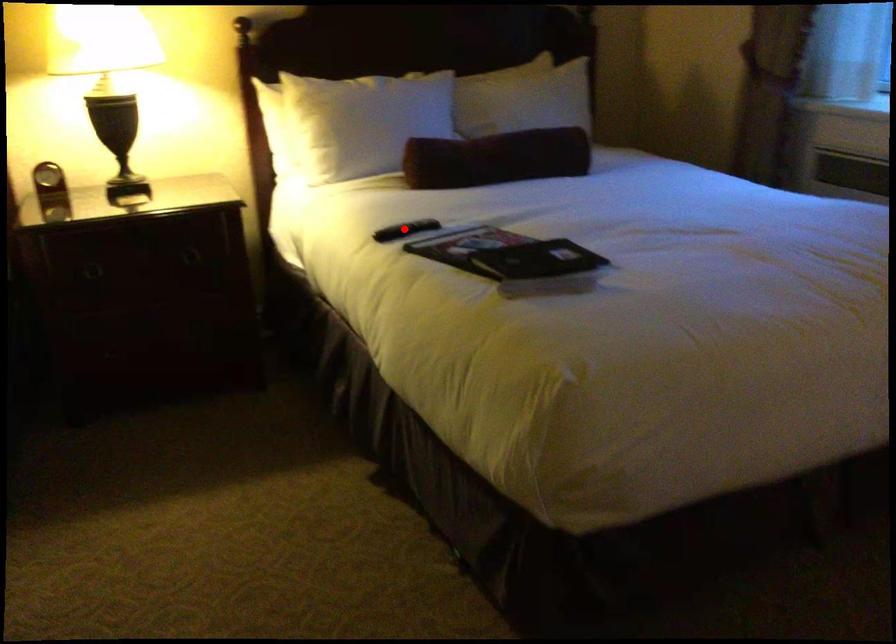
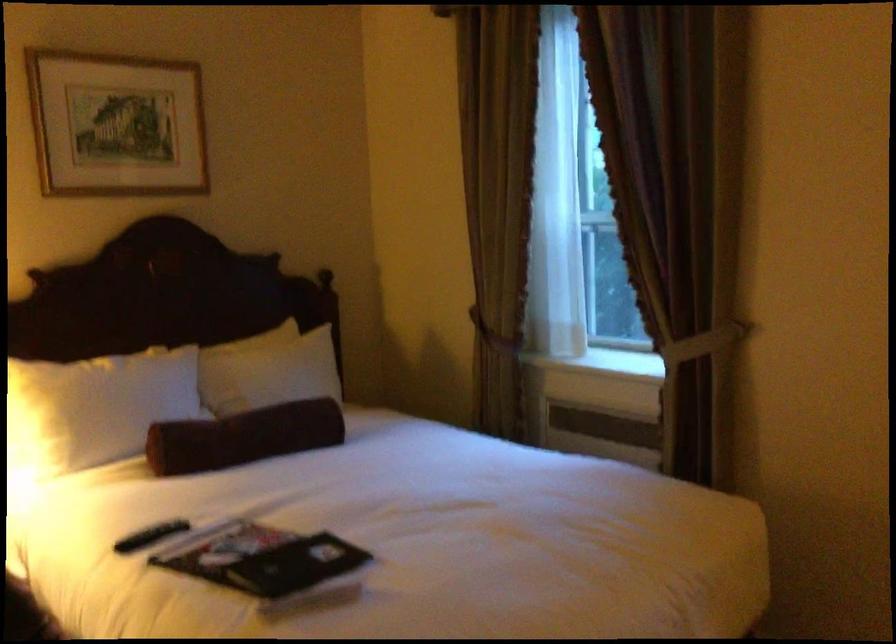
Locate, in the second image, the point that corresponds to the highlighted location in the first image.

(151, 536)